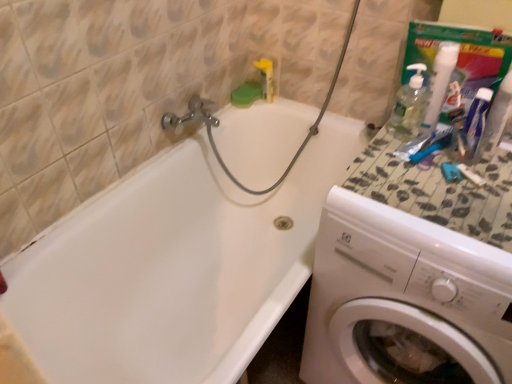
Question: Is white plastic toothpaste at upper right a part of white glossy bathtub at upper left?

Choices:
 (A) yes
 (B) no

Answer: (B)

Question: Is white glossy bathtub at upper left facing away from white plastic toothpaste at upper right?

Choices:
 (A) yes
 (B) no

Answer: (B)

Question: Is white glossy bathtub at upper left to the left of white plastic toothpaste at upper right from the viewer's perspective?

Choices:
 (A) no
 (B) yes

Answer: (B)

Question: Can you confirm if white glossy bathtub at upper left is shorter than white plastic toothpaste at upper right?

Choices:
 (A) yes
 (B) no

Answer: (B)

Question: Does white glossy bathtub at upper left come in front of white plastic toothpaste at upper right?

Choices:
 (A) no
 (B) yes

Answer: (B)

Question: Is white glossy bathtub at upper left wider than white plastic toothpaste at upper right?

Choices:
 (A) yes
 (B) no

Answer: (A)

Question: Is the depth of clear liquid soap at upper right, marked as the first cleaning product in a left-to-right arrangement, less than that of white glossy bathtub at upper left?

Choices:
 (A) no
 (B) yes

Answer: (A)

Question: From a real-world perspective, is clear liquid soap at upper right, positioned as the 2th cleaning product in right-to-left order, on white glossy bathtub at upper left?

Choices:
 (A) yes
 (B) no

Answer: (A)

Question: Considering the relative sizes of clear liquid soap at upper right, positioned as the 2th cleaning product in right-to-left order, and white glossy bathtub at upper left in the image provided, is clear liquid soap at upper right, positioned as the 2th cleaning product in right-to-left order, thinner than white glossy bathtub at upper left?

Choices:
 (A) yes
 (B) no

Answer: (A)

Question: Would you say white glossy bathtub at upper left is part of clear liquid soap at upper right, positioned as the 2th cleaning product in right-to-left order,'s contents?

Choices:
 (A) no
 (B) yes

Answer: (A)

Question: Is white glossy bathtub at upper left at the back of clear liquid soap at upper right, marked as the first cleaning product in a left-to-right arrangement?

Choices:
 (A) no
 (B) yes

Answer: (A)

Question: Is clear liquid soap at upper right, marked as the first cleaning product in a left-to-right arrangement, to the left of white glossy bathtub at upper left from the viewer's perspective?

Choices:
 (A) yes
 (B) no

Answer: (B)

Question: Is white plastic washing machine at right facing away from white pump bottle at upper right, the 1th cleaning product viewed from the right?

Choices:
 (A) yes
 (B) no

Answer: (B)